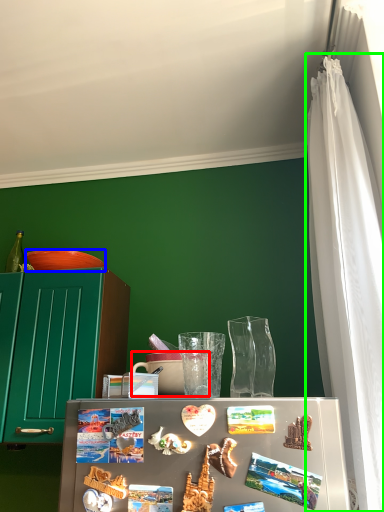
Question: Based on their relative distances, which object is farther from coffee cup (highlighted by a red box)? Choose from bowl (highlighted by a blue box) and curtain (highlighted by a green box).

Choices:
 (A) bowl
 (B) curtain

Answer: (B)